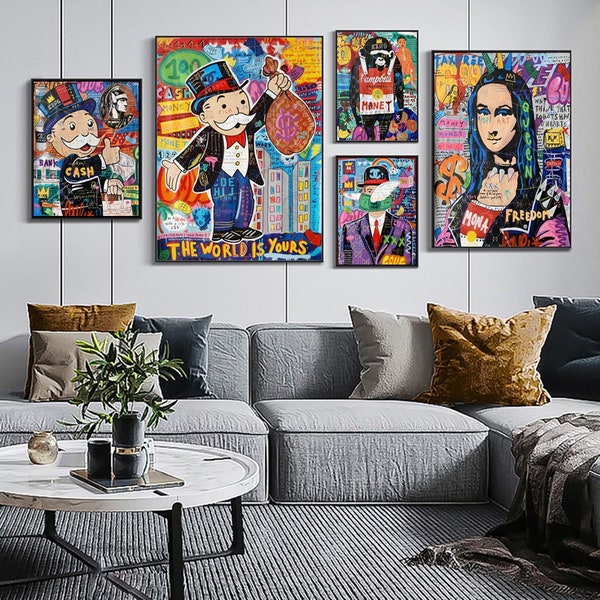
Find the location of a particular element. This screenshot has height=600, width=600. wall is located at coordinates (86, 41).